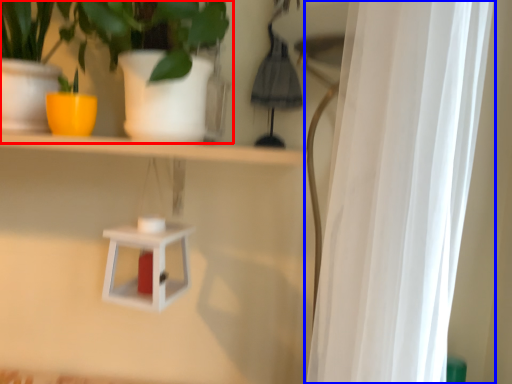
Question: Among these objects, which one is farthest to the camera, houseplant (highlighted by a red box) or curtain (highlighted by a blue box)?

Choices:
 (A) houseplant
 (B) curtain

Answer: (A)